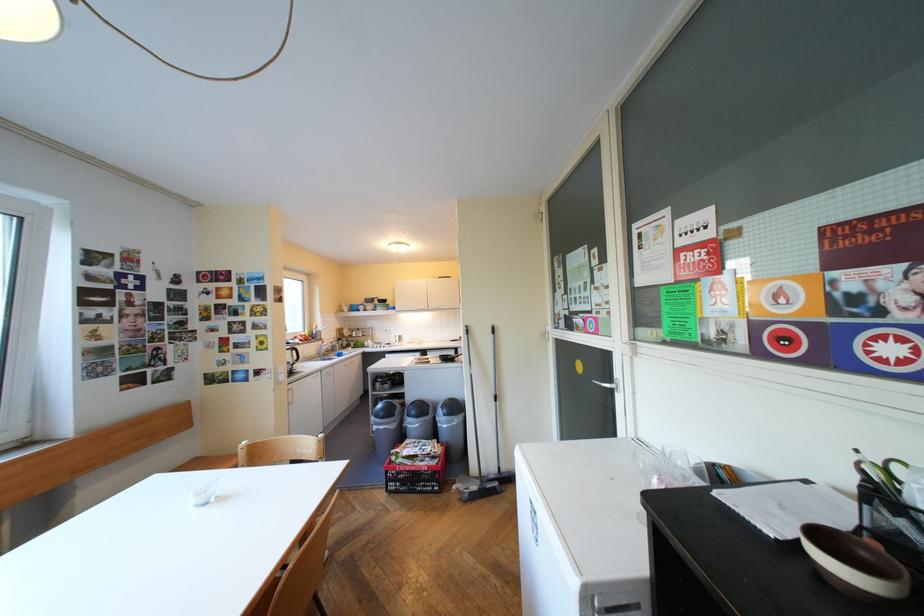
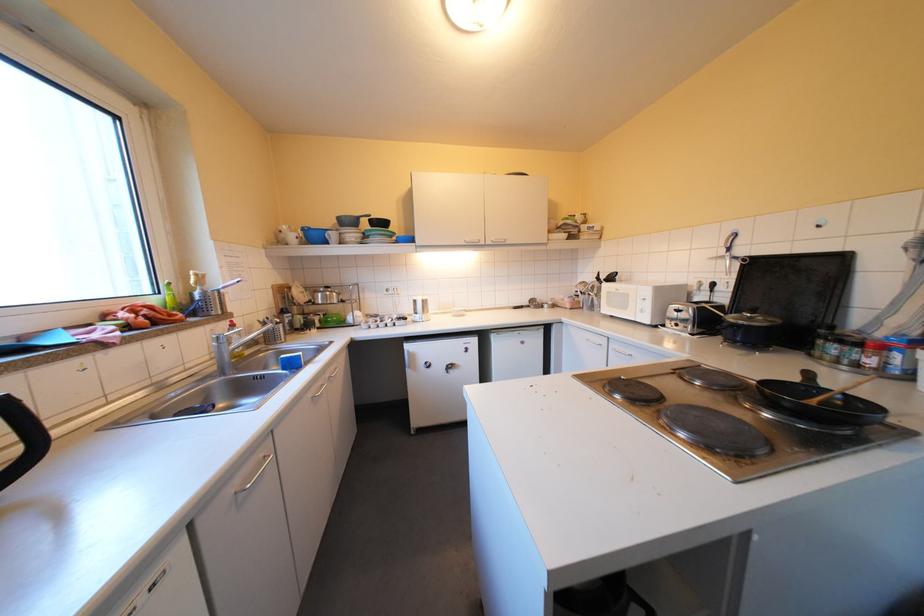
Find the pixel in the second image that matches (x=377, y=345) in the first image.

(356, 323)